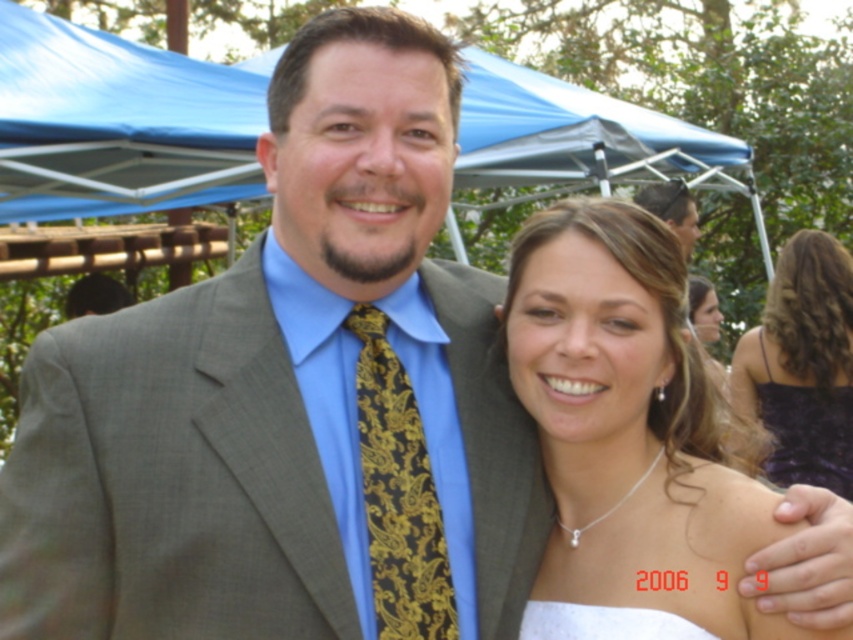
You are a photographer at a wedding. The couple is standing 5.11 feet apart. You need to take a photo that includes both the matte gray suit at center and the woman in white strapless dress. Can you position yourself so that both subjects are in the frame without moving them?

Yes, since the couple is 5.11 feet apart, positioning the camera to include both the matte gray suit at center and the woman in white strapless dress in the frame is feasible as long as the camera lens has an appropriate angle of view to capture the distance between them.

You are a photographer at a wedding reception. You need to capture a close shot of the white satin dress at center. The camera you are using has a focus point at coordinate point [630,428]. Is the focus point correctly positioned to capture the dress?

Yes, the focus point at coordinate point [630,428] is correctly positioned to capture the white satin dress at center because the point marks the dress.

You are a photographer at a wedding reception and need to ensure that the matte gray suit at center and the gold paisley tie at center are both visible in the photo. Given that the camera has a limited focus range, which object should you prioritize focusing on to ensure it remains sharp?

The matte gray suit at center is larger in size than the gold paisley tie at center, so focusing on the matte gray suit at center would ensure it remains sharp within the limited focus range.